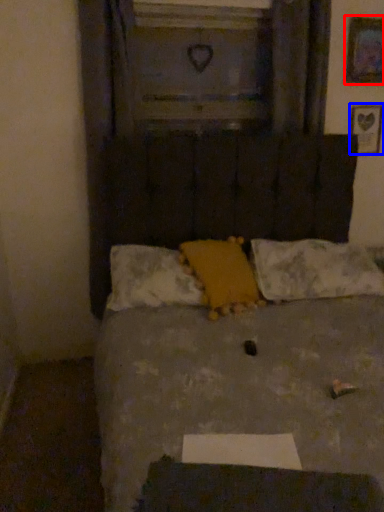
Question: Which point is further to the camera, picture frame (highlighted by a red box) or picture frame (highlighted by a blue box)?

Choices:
 (A) picture frame
 (B) picture frame

Answer: (B)